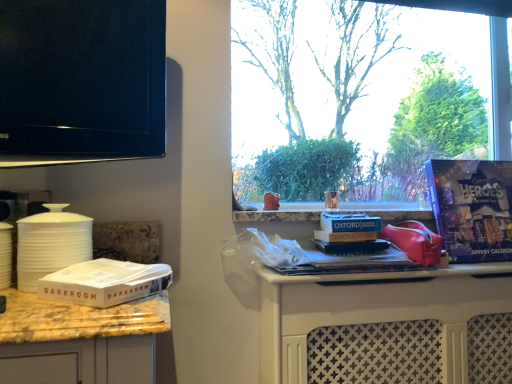
Question: Is white cardboard box at lower left in contact with purple cardboard advent calendar at right?

Choices:
 (A) yes
 (B) no

Answer: (B)

Question: From a real-world perspective, is white cardboard box at lower left under purple cardboard advent calendar at right?

Choices:
 (A) no
 (B) yes

Answer: (B)

Question: Are white cardboard box at lower left and purple cardboard advent calendar at right located far from each other?

Choices:
 (A) yes
 (B) no

Answer: (A)

Question: Is white cardboard box at lower left bigger than purple cardboard advent calendar at right?

Choices:
 (A) no
 (B) yes

Answer: (A)

Question: Does white cardboard box at lower left appear on the left side of purple cardboard advent calendar at right?

Choices:
 (A) yes
 (B) no

Answer: (A)

Question: From the image's perspective, does white cardboard box at lower left appear lower than purple cardboard advent calendar at right?

Choices:
 (A) yes
 (B) no

Answer: (A)

Question: Considering the relative positions of white cardboard box at lower left and black glossy tv at upper left in the image provided, is white cardboard box at lower left behind black glossy tv at upper left?

Choices:
 (A) yes
 (B) no

Answer: (B)

Question: Considering the relative sizes of white cardboard box at lower left and black glossy tv at upper left in the image provided, is white cardboard box at lower left thinner than black glossy tv at upper left?

Choices:
 (A) no
 (B) yes

Answer: (A)

Question: Can you confirm if white cardboard box at lower left is smaller than black glossy tv at upper left?

Choices:
 (A) yes
 (B) no

Answer: (A)

Question: Is white cardboard box at lower left completely or partially outside of black glossy tv at upper left?

Choices:
 (A) no
 (B) yes

Answer: (B)

Question: Is white cardboard box at lower left at the left side of black glossy tv at upper left?

Choices:
 (A) no
 (B) yes

Answer: (A)

Question: From the image's perspective, is white cardboard box at lower left under black glossy tv at upper left?

Choices:
 (A) no
 (B) yes

Answer: (B)

Question: Is black glossy tv at upper left facing towards white cardboard box at lower left?

Choices:
 (A) no
 (B) yes

Answer: (A)